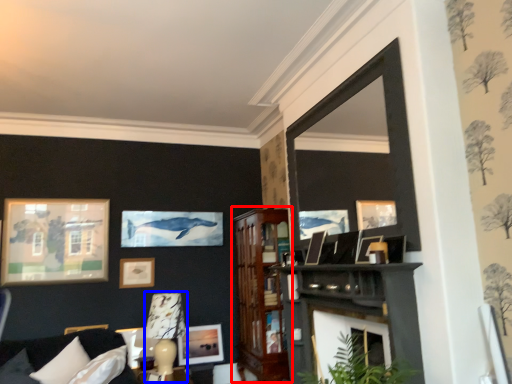
Question: Which object appears closest to the camera in this image, dresser (highlighted by a red box) or lamp (highlighted by a blue box)?

Choices:
 (A) dresser
 (B) lamp

Answer: (B)